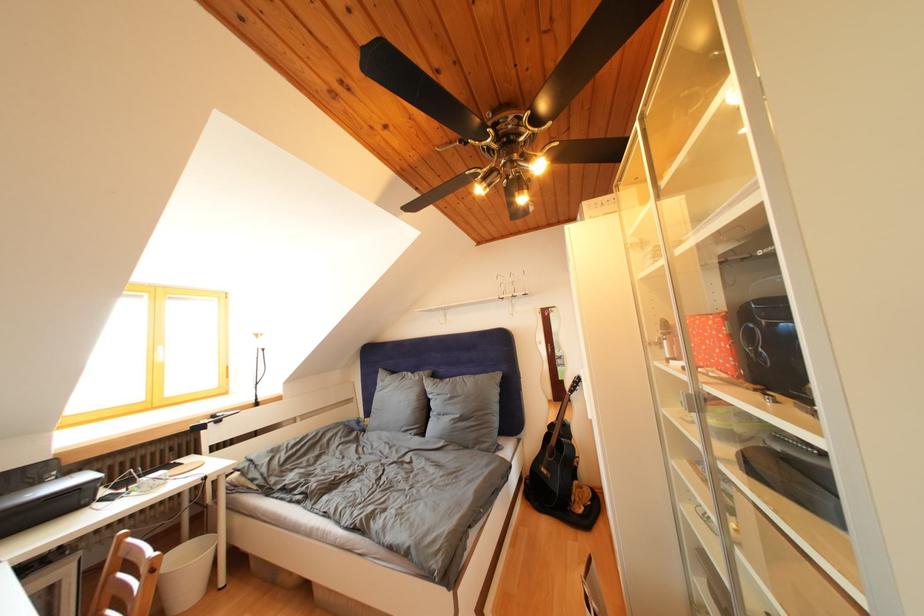
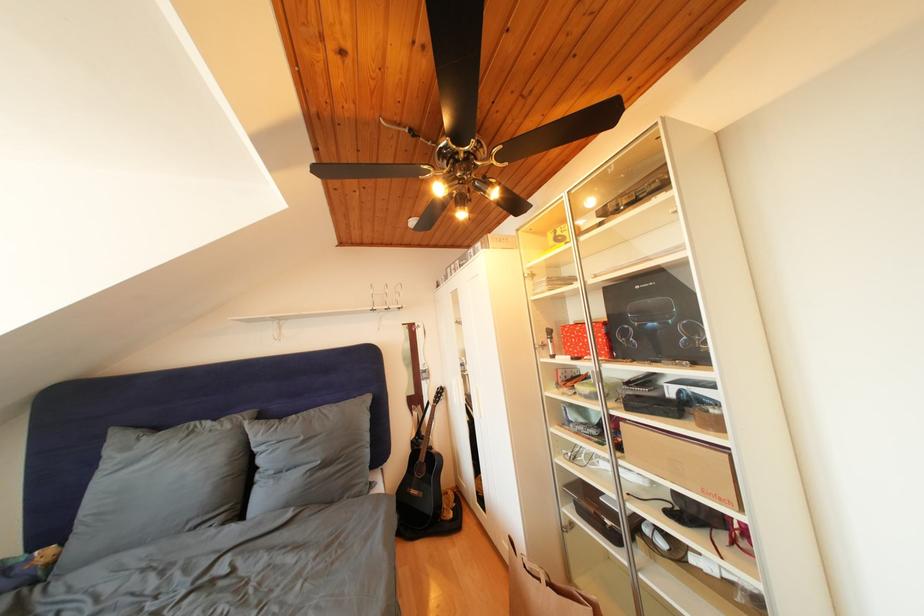
Question: The first image is from the beginning of the video and the second image is from the end. How did the camera likely rotate when shooting the video?

Choices:
 (A) Left
 (B) Right
 (C) Up
 (D) Down

Answer: (B)